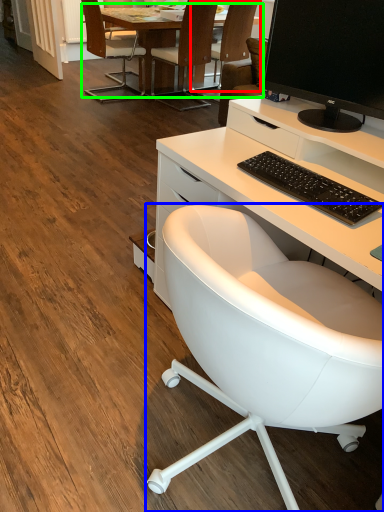
Question: Which object is the closest to the chair (highlighted by a red box)? Choose among these: chair (highlighted by a blue box) or table (highlighted by a green box).

Choices:
 (A) chair
 (B) table

Answer: (B)